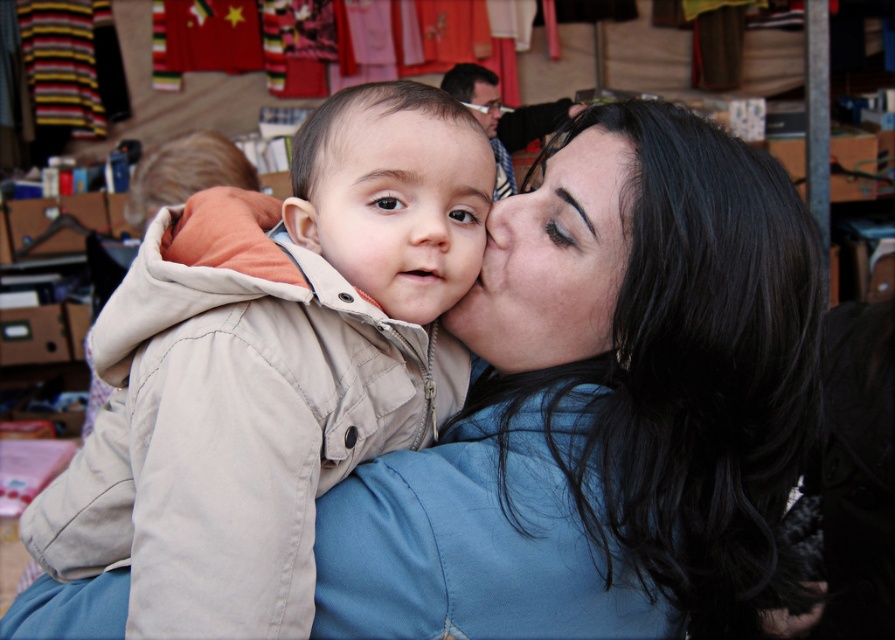
Is beige cotton jacket at center wider than matte black face at center?

Yes, beige cotton jacket at center is wider than matte black face at center.

Based on the photo, between beige cotton jacket at center and matte black face at center, which one is positioned lower?

beige cotton jacket at center is lower down.

Identify the location of beige cotton jacket at center. This screenshot has height=640, width=895. (280, 376).

At what (x,y) coordinates should I click in order to perform the action: click on beige cotton jacket at center. Please return your answer as a coordinate pair (x, y). The width and height of the screenshot is (895, 640). Looking at the image, I should click on (280, 376).

Is matte beige jacket at center above smooth skin face at center?

Yes.

Between matte beige jacket at center and smooth skin face at center, which one appears on the right side from the viewer's perspective?

From the viewer's perspective, smooth skin face at center appears more on the right side.

Where is `matte beige jacket at center`? This screenshot has height=640, width=895. matte beige jacket at center is located at coordinates (399, 209).

Does smooth skin face at center have a lesser width compared to matte black face at center?

Incorrect, smooth skin face at center's width is not less than matte black face at center's.

Who is more forward, (612, 256) or (493, 90)?

Point (612, 256)

Identify the location of smooth skin face at center. The image size is (895, 640). (553, 260).